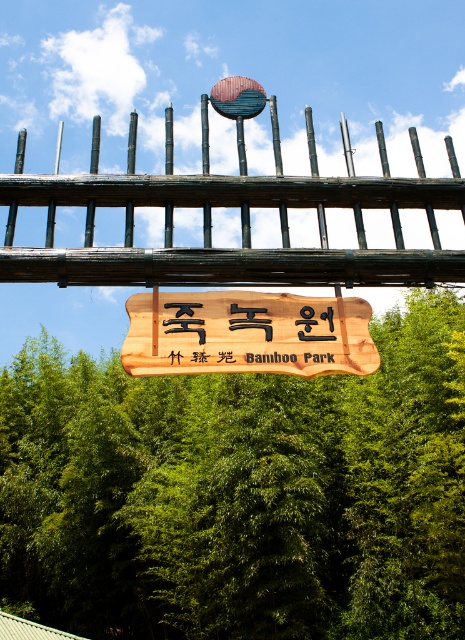
Question: Does green leafy tree at center come behind weathered wood fence at upper center?

Choices:
 (A) no
 (B) yes

Answer: (B)

Question: Which point is farther from the camera taking this photo?

Choices:
 (A) (20, 436)
 (B) (277, 349)

Answer: (A)

Question: Is weathered wood fence at upper center smaller than wooden sign at center?

Choices:
 (A) yes
 (B) no

Answer: (A)

Question: Based on their relative distances, which object is farther from the weathered wood fence at upper center?

Choices:
 (A) green leafy tree at center
 (B) wooden sign at center

Answer: (A)

Question: Which of the following is the farthest from the observer?

Choices:
 (A) wooden sign at center
 (B) weathered wood fence at upper center

Answer: (B)

Question: Is weathered wood fence at upper center further to the viewer compared to wooden sign at center?

Choices:
 (A) no
 (B) yes

Answer: (B)